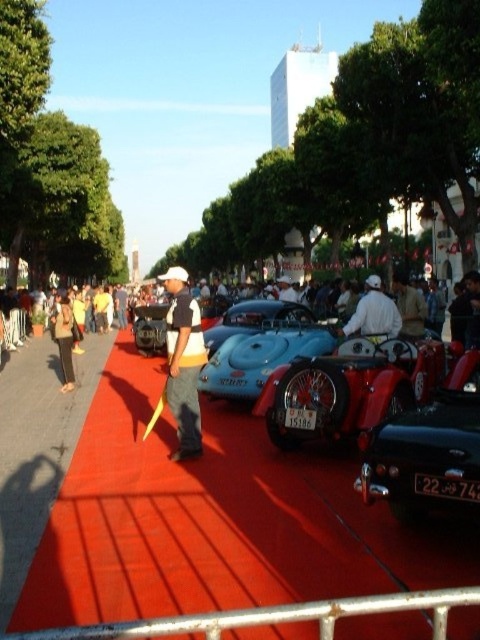
Question: Does dark brown pants at left appear over matte white helmet at center?

Choices:
 (A) yes
 (B) no

Answer: (B)

Question: Which point is closer to the camera taking this photo?

Choices:
 (A) (212, 349)
 (B) (334, 417)
 (C) (436, 500)
 (D) (290, 346)

Answer: (C)

Question: Which point is closer to the camera?

Choices:
 (A) shiny black car at center
 (B) matte white cap at center

Answer: (A)

Question: From the image, what is the correct spatial relationship of dark brown pants at left in relation to matte white helmet at center?

Choices:
 (A) right
 (B) left

Answer: (B)

Question: Is shiny chrome motorcycle at center thinner than blue glossy car at center?

Choices:
 (A) no
 (B) yes

Answer: (A)

Question: Which point is farther to the camera?

Choices:
 (A) matte white cap at center
 (B) blue glossy car at center

Answer: (B)